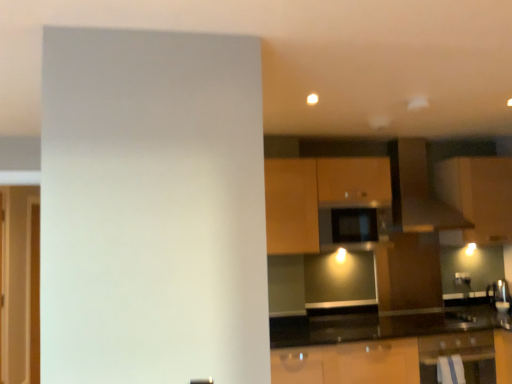
Locate an element on the screen. Image resolution: width=512 pixels, height=384 pixels. wooden cabinet at center, the 1th cabinetry from the left is located at coordinates (317, 196).

Measure the distance between metallic silver oven at lower right and camera.

The distance of metallic silver oven at lower right from camera is 9.74 feet.

Locate an element on the screen. The height and width of the screenshot is (384, 512). metallic silver oven at lower right is located at coordinates (460, 356).

Measure the distance between point (439,170) and camera.

Point (439,170) and camera are 3.71 meters apart.

What do you see at coordinates (477, 197) in the screenshot? I see `matte brown cabinet at upper right, the 3th cabinetry from the left` at bounding box center [477, 197].

This screenshot has height=384, width=512. I want to click on black matte microwave at center, so click(x=352, y=228).

From the image's perspective, between black matte microwave at center and metallic silver oven at lower right, who is located below?

metallic silver oven at lower right is shown below in the image.

Which is more to the left, black matte microwave at center or metallic silver oven at lower right?

From the viewer's perspective, black matte microwave at center appears more on the left side.

Are black matte microwave at center and metallic silver oven at lower right making contact?

No, black matte microwave at center is not in contact with metallic silver oven at lower right.

Which of these two, black matte microwave at center or metallic silver oven at lower right, is thinner?

With smaller width is black matte microwave at center.

Is matte brown cabinet at upper right, which is the 1th cabinetry in right-to-left order, far from transparent glass door at left?

Indeed, matte brown cabinet at upper right, which is the 1th cabinetry in right-to-left order, is not near transparent glass door at left.

Is matte brown cabinet at upper right, which is the 1th cabinetry in right-to-left order, positioned with its back to transparent glass door at left?

No, matte brown cabinet at upper right, which is the 1th cabinetry in right-to-left order,'s orientation is not away from transparent glass door at left.

Which of these two, matte brown cabinet at upper right, which is the 1th cabinetry in right-to-left order, or transparent glass door at left, stands taller?

Standing taller between the two is transparent glass door at left.

This screenshot has width=512, height=384. Identify the location of the 3rd cabinetry to the right when counting from the transparent glass door at left. (477, 197).

Which of these two, matte brown cabinet at upper right, the 3th cabinetry from the left, or wooden cabinet at center, the 1th cabinetry from the left, is wider?

matte brown cabinet at upper right, the 3th cabinetry from the left, is wider.

Which object is closer to the camera taking this photo, matte brown cabinet at upper right, the 3th cabinetry from the left, or wooden cabinet at center, the 1th cabinetry from the left?

Positioned in front is wooden cabinet at center, the 1th cabinetry from the left.

From the image's perspective, would you say matte brown cabinet at upper right, which is the 1th cabinetry in right-to-left order, is positioned over wooden cabinet at center, the 1th cabinetry from the left?

Yes, from the image's perspective, matte brown cabinet at upper right, which is the 1th cabinetry in right-to-left order, is over wooden cabinet at center, the 1th cabinetry from the left.

From a real-world perspective, which object rests below the other?

metallic silver oven at lower right is physically lower.

Would you say transparent glass door at left is inside or outside metallic silver oven at lower right?

transparent glass door at left is located beyond the bounds of metallic silver oven at lower right.

Between transparent glass door at left and metallic silver oven at lower right, which one has larger width?

Wider between the two is metallic silver oven at lower right.

Considering the positions of points (15, 360) and (487, 366), is point (15, 360) farther from camera compared to point (487, 366)?

Yes, point (15, 360) is behind point (487, 366).

Would you say black matte microwave at center is a long distance from matte brown exhaust hood at upper center?

No.

In the image, there is a black matte microwave at center. Where is `exhaust hood above it (from the image's perspective)`? exhaust hood above it (from the image's perspective) is located at coordinates (417, 191).

Can you confirm if black matte microwave at center is positioned to the right of matte brown exhaust hood at upper center?

In fact, black matte microwave at center is to the left of matte brown exhaust hood at upper center.

From a real-world perspective, is black matte microwave at center physically located above or below matte brown exhaust hood at upper center?

From a real-world perspective, black matte microwave at center is physically below matte brown exhaust hood at upper center.

Relative to metallic silver oven at lower right, is matte brown exhaust hood at upper center in front or behind?

Visually, matte brown exhaust hood at upper center is located behind metallic silver oven at lower right.

From the image's perspective, is matte brown exhaust hood at upper center located above or below metallic silver oven at lower right?

From the image's perspective, matte brown exhaust hood at upper center appears above metallic silver oven at lower right.

Where is `oven to the right of matte brown exhaust hood at upper center`? The height and width of the screenshot is (384, 512). oven to the right of matte brown exhaust hood at upper center is located at coordinates (460, 356).

Is black matte microwave at center at the back of matte brown exhaust hood at upper center?

No.

Considering the sizes of objects matte brown exhaust hood at upper center and black matte microwave at center in the image provided, who is taller, matte brown exhaust hood at upper center or black matte microwave at center?

matte brown exhaust hood at upper center.

Is matte brown exhaust hood at upper center smaller than black matte microwave at center?

Incorrect, matte brown exhaust hood at upper center is not smaller in size than black matte microwave at center.

In order to click on oven below the black matte microwave at center (from a real-world perspective) in this screenshot , I will do `click(460, 356)`.

At what (x,y) coordinates should I click in order to perform the action: click on cabinetry that is the 3rd object to the right of the transparent glass door at left, starting at the anchor. Please return your answer as a coordinate pair (x, y). Looking at the image, I should click on (477, 197).

Estimate the real-world distances between objects in this image. Which object is closer to metallic silver oven at lower right, matte brown exhaust hood at upper center or matte brown cabinet at center, marked as the second cabinetry in a left-to-right arrangement?

matte brown cabinet at center, marked as the second cabinetry in a left-to-right arrangement, lies closer to metallic silver oven at lower right than the other object.

Estimate the real-world distances between objects in this image. Which object is closer to matte brown cabinet at center, which is counted as the 2th cabinetry, starting from the right, wooden cabinet at center, which appears as the third cabinetry when viewed from the right, or transparent glass door at left?

The object closer to matte brown cabinet at center, which is counted as the 2th cabinetry, starting from the right, is wooden cabinet at center, which appears as the third cabinetry when viewed from the right.

From the picture: From the image, which object appears to be nearer to black matte microwave at center, wooden cabinet at center, which appears as the third cabinetry when viewed from the right, or transparent glass door at left?

wooden cabinet at center, which appears as the third cabinetry when viewed from the right, is closer to black matte microwave at center.

Consider the image. When comparing their distances from transparent glass door at left, does wooden cabinet at center, which appears as the third cabinetry when viewed from the right, or metallic silver oven at lower right seem further?

metallic silver oven at lower right is positioned further to the anchor transparent glass door at left.

Considering their positions, is wooden cabinet at center, the 1th cabinetry from the left, positioned further to black matte microwave at center than matte brown cabinet at upper right, the 3th cabinetry from the left?

Based on the image, matte brown cabinet at upper right, the 3th cabinetry from the left, appears to be further to black matte microwave at center.

Based on their spatial positions, is wooden cabinet at center, the 1th cabinetry from the left, or matte brown cabinet at center, which is counted as the 2th cabinetry, starting from the right, further from matte brown cabinet at upper right, the 3th cabinetry from the left?

wooden cabinet at center, the 1th cabinetry from the left.

When comparing their distances from transparent glass door at left, does wooden cabinet at center, which appears as the third cabinetry when viewed from the right, or matte brown exhaust hood at upper center seem closer?

wooden cabinet at center, which appears as the third cabinetry when viewed from the right.

Estimate the real-world distances between objects in this image. Which object is closer to matte brown cabinet at upper right, the 3th cabinetry from the left, black matte microwave at center or metallic silver oven at lower right?

Among the two, black matte microwave at center is located nearer to matte brown cabinet at upper right, the 3th cabinetry from the left.

Identify the location of cabinetry between black matte microwave at center and metallic silver oven at lower right in the vertical direction. (409, 272).

Find the location of a particular element. This screenshot has width=512, height=384. cabinetry between transparent glass door at left and black matte microwave at center from left to right is located at coordinates point(317,196).

Find the location of a particular element. appliance between matte brown exhaust hood at upper center and matte brown cabinet at center, which is counted as the 2th cabinetry, starting from the right, vertically is located at coordinates (352, 228).

This screenshot has height=384, width=512. I want to click on exhaust hood between transparent glass door at left and matte brown cabinet at upper right, which is the 1th cabinetry in right-to-left order, in the horizontal direction, so click(417, 191).